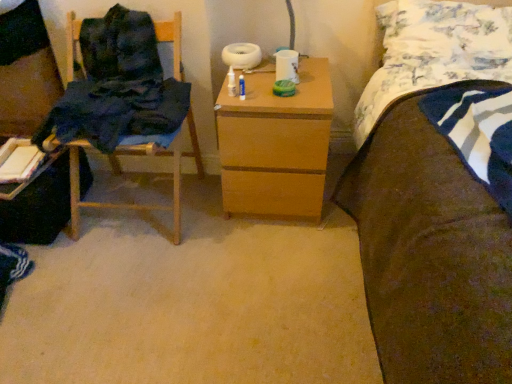
Question: From a real-world perspective, does wooden chair at left stand above dark blue fabric chair at left?

Choices:
 (A) yes
 (B) no

Answer: (A)

Question: Can you confirm if wooden chair at left is wider than dark blue fabric chair at left?

Choices:
 (A) no
 (B) yes

Answer: (B)

Question: Is wooden chair at left shorter than dark blue fabric chair at left?

Choices:
 (A) yes
 (B) no

Answer: (B)

Question: Is dark blue fabric chair at left surrounded by wooden chair at left?

Choices:
 (A) no
 (B) yes

Answer: (A)

Question: Considering the relative positions of wooden chair at left and dark blue fabric chair at left in the image provided, is wooden chair at left to the right of dark blue fabric chair at left from the viewer's perspective?

Choices:
 (A) no
 (B) yes

Answer: (B)

Question: Considering the relative sizes of wooden chair at left and dark blue fabric chair at left in the image provided, is wooden chair at left thinner than dark blue fabric chair at left?

Choices:
 (A) no
 (B) yes

Answer: (A)

Question: From the image's perspective, is dark blue fabric at left below white cardboard book at left?

Choices:
 (A) yes
 (B) no

Answer: (B)

Question: Considering the relative sizes of dark blue fabric at left and white cardboard book at left in the image provided, is dark blue fabric at left wider than white cardboard book at left?

Choices:
 (A) yes
 (B) no

Answer: (A)

Question: From a real-world perspective, is dark blue fabric at left beneath white cardboard book at left?

Choices:
 (A) no
 (B) yes

Answer: (A)

Question: Does dark blue fabric at left have a greater height compared to white cardboard book at left?

Choices:
 (A) yes
 (B) no

Answer: (A)

Question: Does dark blue fabric at left have a lesser height compared to white cardboard book at left?

Choices:
 (A) no
 (B) yes

Answer: (A)

Question: Is dark blue fabric at left facing towards white cardboard book at left?

Choices:
 (A) no
 (B) yes

Answer: (A)

Question: Is wooden nightstand at center at the right side of dark blue fabric at left?

Choices:
 (A) no
 (B) yes

Answer: (B)